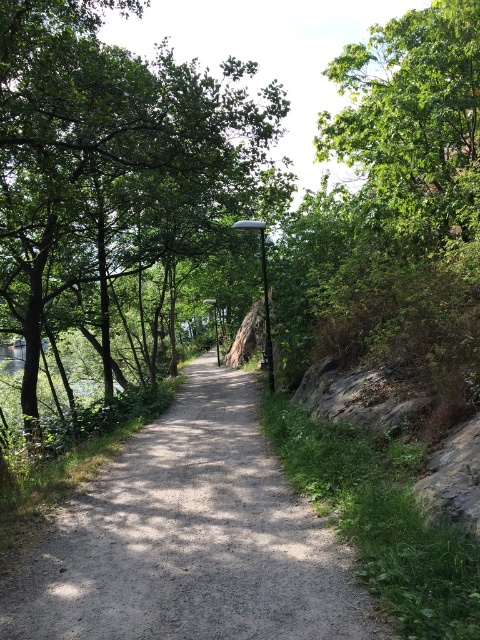
Question: Does green leafy tree at upper left have a lesser width compared to green leafy tree at upper right?

Choices:
 (A) no
 (B) yes

Answer: (A)

Question: Which point is closer to the camera taking this photo?

Choices:
 (A) (156, 484)
 (B) (70, 211)

Answer: (A)

Question: Estimate the real-world distances between objects in this image. Which object is farther from the green leafy tree at upper left?

Choices:
 (A) dirt/gravel path at center
 (B) green leafy tree at upper right

Answer: (A)

Question: Can you confirm if green leafy tree at upper left is positioned to the left of dirt/gravel path at center?

Choices:
 (A) no
 (B) yes

Answer: (B)

Question: Which point is closer to the camera?

Choices:
 (A) green leafy tree at upper right
 (B) dirt/gravel path at center
 (C) green leafy tree at upper left

Answer: (B)

Question: Does dirt/gravel path at center have a larger size compared to green leafy tree at upper right?

Choices:
 (A) no
 (B) yes

Answer: (A)